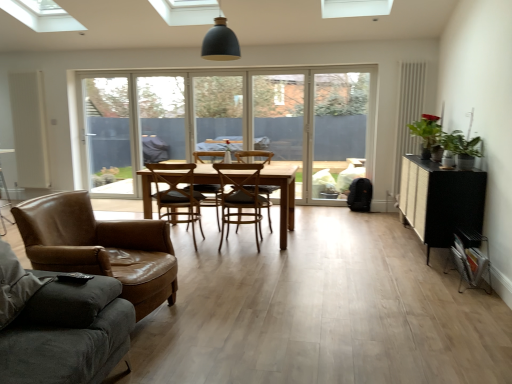
Question: In which direction should I rotate to look at wooden chair at center, which appears as the 2th chair when viewed from the front?

Choices:
 (A) left
 (B) right

Answer: (A)

Question: From a real-world perspective, does matte black pendant lamp at upper center sit lower than black textured cabinet at right?

Choices:
 (A) no
 (B) yes

Answer: (A)

Question: Considering the relative sizes of matte black pendant lamp at upper center and black textured cabinet at right in the image provided, is matte black pendant lamp at upper center bigger than black textured cabinet at right?

Choices:
 (A) no
 (B) yes

Answer: (A)

Question: Is black textured cabinet at right inside matte black pendant lamp at upper center?

Choices:
 (A) yes
 (B) no

Answer: (B)

Question: Considering the relative sizes of matte black pendant lamp at upper center and black textured cabinet at right in the image provided, is matte black pendant lamp at upper center smaller than black textured cabinet at right?

Choices:
 (A) no
 (B) yes

Answer: (B)

Question: Is matte black pendant lamp at upper center to the right of black textured cabinet at right from the viewer's perspective?

Choices:
 (A) no
 (B) yes

Answer: (A)

Question: Are matte black pendant lamp at upper center and black textured cabinet at right making contact?

Choices:
 (A) yes
 (B) no

Answer: (B)

Question: Can you confirm if dark gray fabric studio couch at lower left is wider than white matte screen door at left, the second screen door in the right-to-left sequence?

Choices:
 (A) no
 (B) yes

Answer: (B)

Question: Is dark gray fabric studio couch at lower left bigger than white matte screen door at left, which appears as the first screen door when viewed from the left?

Choices:
 (A) yes
 (B) no

Answer: (A)

Question: Is dark gray fabric studio couch at lower left not inside white matte screen door at left, which appears as the first screen door when viewed from the left?

Choices:
 (A) yes
 (B) no

Answer: (A)

Question: Considering the relative sizes of dark gray fabric studio couch at lower left and white matte screen door at left, which appears as the first screen door when viewed from the left, in the image provided, is dark gray fabric studio couch at lower left taller than white matte screen door at left, which appears as the first screen door when viewed from the left,?

Choices:
 (A) no
 (B) yes

Answer: (A)

Question: From a real-world perspective, is dark gray fabric studio couch at lower left on top of white matte screen door at left, the second screen door in the right-to-left sequence?

Choices:
 (A) yes
 (B) no

Answer: (B)

Question: Could you tell me if dark gray fabric studio couch at lower left is turned towards white matte screen door at left, which appears as the first screen door when viewed from the left?

Choices:
 (A) yes
 (B) no

Answer: (B)

Question: Is light brown wooden table at center positioned with its back to wooden chair at center, arranged as the 3th chair when viewed from the back?

Choices:
 (A) no
 (B) yes

Answer: (B)